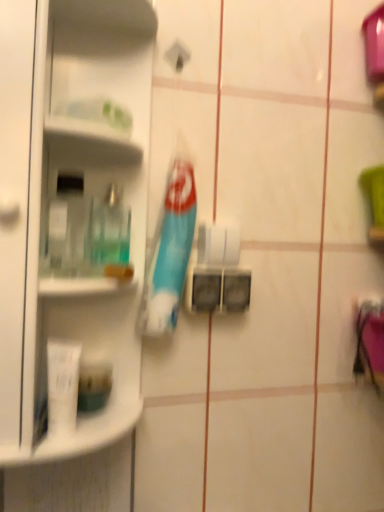
Describe the element at coordinates (109, 229) in the screenshot. I see `translucent plastic mouthwash at left` at that location.

What do you see at coordinates (62, 384) in the screenshot? This screenshot has width=384, height=512. I see `white matte tube at lower left, the second toiletry in the back-to-front sequence` at bounding box center [62, 384].

Describe the element at coordinates (68, 228) in the screenshot. The image size is (384, 512). I see `clear plastic bottle at left` at that location.

Locate an element on the screen. The width and height of the screenshot is (384, 512). matte green container at lower left, the second toiletry in the front-to-back sequence is located at coordinates (94, 386).

Find the location of `white glossy shelf at upper left`. white glossy shelf at upper left is located at coordinates (81, 218).

I want to click on white matte toilet paper at center, so click(218, 244).

Can you confirm if translucent plastic mouthwash at left is positioned to the left of clear plastic bottle at left?

Incorrect, translucent plastic mouthwash at left is not on the left side of clear plastic bottle at left.

Image resolution: width=384 pixels, height=512 pixels. I want to click on cleaning product above the translucent plastic mouthwash at left (from the image's perspective), so click(68, 228).

From the image's perspective, is translucent plastic mouthwash at left above or below clear plastic bottle at left?

Based on their image positions, translucent plastic mouthwash at left is located beneath clear plastic bottle at left.

Is translucent plastic mouthwash at left surrounding clear plastic bottle at left?

That's incorrect, clear plastic bottle at left is not inside translucent plastic mouthwash at left.

From a real-world perspective, does matte green container at lower left, the second toiletry in the front-to-back sequence, stand above white matte toilet paper at center?

No, from a real-world perspective, matte green container at lower left, the second toiletry in the front-to-back sequence, is not over white matte toilet paper at center

Is matte green container at lower left, the second toiletry in the front-to-back sequence, with white matte toilet paper at center?

They are not placed beside each other.

Considering the positions of objects matte green container at lower left, the second toiletry in the front-to-back sequence, and white matte toilet paper at center in the image provided, who is more to the left, matte green container at lower left, the second toiletry in the front-to-back sequence, or white matte toilet paper at center?

matte green container at lower left, the second toiletry in the front-to-back sequence.

Considering the relative sizes of matte green container at lower left, the second toiletry in the front-to-back sequence, and white matte toilet paper at center in the image provided, is matte green container at lower left, the second toiletry in the front-to-back sequence, taller than white matte toilet paper at center?

Incorrect, the height of matte green container at lower left, the second toiletry in the front-to-back sequence, is not larger of that of white matte toilet paper at center.

Which object is further away from the camera, translucent plastic mouthwash at left or white matte toilet paper at center?

white matte toilet paper at center is further from the camera.

From the image's perspective, which one is positioned higher, translucent plastic mouthwash at left or white matte toilet paper at center?

From the image's view, translucent plastic mouthwash at left is above.

Is translucent plastic mouthwash at left shorter than white matte toilet paper at center?

No, translucent plastic mouthwash at left is not shorter than white matte toilet paper at center.

Considering the positions of objects white matte toilet paper at center and matte green container at lower left, the second toiletry in the front-to-back sequence, in the image provided, who is more to the right, white matte toilet paper at center or matte green container at lower left, the second toiletry in the front-to-back sequence,?

Positioned to the right is white matte toilet paper at center.

Which of these two, white matte toilet paper at center or matte green container at lower left, the second toiletry in the front-to-back sequence, is smaller?

white matte toilet paper at center is smaller.

Does white matte toilet paper at center have a greater width compared to matte green container at lower left, which is the 1th toiletry from back to front?

In fact, white matte toilet paper at center might be narrower than matte green container at lower left, which is the 1th toiletry from back to front.

Consider the image. Can you tell me how much white matte toilet paper at center and matte green container at lower left, the second toiletry in the front-to-back sequence, differ in facing direction?

0.884 degrees.

From a real-world perspective, is matte green container at lower left, which is the 1th toiletry from back to front, on white glossy shelf at upper left?

No, from a real-world perspective, matte green container at lower left, which is the 1th toiletry from back to front, is not above white glossy shelf at upper left.

Does matte green container at lower left, the second toiletry in the front-to-back sequence, turn towards white glossy shelf at upper left?

Yes.

Based on the photo, is matte green container at lower left, the second toiletry in the front-to-back sequence, outside of white glossy shelf at upper left?

No, matte green container at lower left, the second toiletry in the front-to-back sequence, is inside or overlapping with white glossy shelf at upper left.

Is white matte toilet paper at center further to camera compared to clear plastic bottle at left?

Yes, it is behind clear plastic bottle at left.

Is white matte toilet paper at center not close to clear plastic bottle at left?

They are positioned close to each other.

Does point (205, 257) appear closer or farther from the camera than point (52, 206)?

Point (205, 257) is farther from the camera than point (52, 206).

Would you say white matte toilet paper at center is to the left or to the right of blue plastic toothbrush at center in the picture?

white matte toilet paper at center is positioned on blue plastic toothbrush at center's right side.

Is the position of white matte toilet paper at center more distant than that of blue plastic toothbrush at center?

Yes, white matte toilet paper at center is behind blue plastic toothbrush at center.

Considering the positions of points (206, 244) and (182, 159), is point (206, 244) farther from camera compared to point (182, 159)?

Yes, it is behind point (182, 159).

This screenshot has height=512, width=384. Find the location of `mouthwash below the clear plastic bottle at left (from the image's perspective)`. mouthwash below the clear plastic bottle at left (from the image's perspective) is located at coordinates (109, 229).

This screenshot has height=512, width=384. What are the coordinates of `toilet paper located on the right of matte green container at lower left, which is the 1th toiletry from back to front` in the screenshot? It's located at (218, 244).

Estimate the real-world distances between objects in this image. Which object is closer to clear plastic bottle at left, white matte toilet paper at center or blue plastic toothbrush at center?

Based on the image, blue plastic toothbrush at center appears to be nearer to clear plastic bottle at left.

Estimate the real-world distances between objects in this image. Which object is closer to white glossy shelf at upper left, white matte toilet paper at center or white matte tube at lower left, the second toiletry in the back-to-front sequence?

white matte tube at lower left, the second toiletry in the back-to-front sequence, is closer to white glossy shelf at upper left.

From the image, which object appears to be farther from clear plastic bottle at left, translucent plastic mouthwash at left or white glossy shelf at upper left?

white glossy shelf at upper left.

Which object lies further to the anchor point translucent plastic mouthwash at left, white glossy shelf at upper left or matte green container at lower left, the second toiletry in the front-to-back sequence?

matte green container at lower left, the second toiletry in the front-to-back sequence, is positioned further to the anchor translucent plastic mouthwash at left.

From the image, which object appears to be farther from clear plastic bottle at left, white glossy shelf at upper left or white matte toilet paper at center?

white matte toilet paper at center is positioned further to the anchor clear plastic bottle at left.

Which object lies nearer to the anchor point blue plastic toothbrush at center, clear plastic bottle at left or translucent plastic mouthwash at left?

translucent plastic mouthwash at left is closer to blue plastic toothbrush at center.

From the image, which object appears to be farther from matte green container at lower left, the second toiletry in the front-to-back sequence, white matte toilet paper at center or white matte tube at lower left, acting as the first toiletry starting from the front?

Based on the image, white matte toilet paper at center appears to be further to matte green container at lower left, the second toiletry in the front-to-back sequence.

Based on their spatial positions, is white matte tube at lower left, acting as the first toiletry starting from the front, or matte green container at lower left, the second toiletry in the front-to-back sequence, further from white matte toilet paper at center?

Among the two, white matte tube at lower left, acting as the first toiletry starting from the front, is located further to white matte toilet paper at center.

Where is `shelf between clear plastic bottle at left and white matte toilet paper at center from left to right`? The width and height of the screenshot is (384, 512). shelf between clear plastic bottle at left and white matte toilet paper at center from left to right is located at coordinates (81, 218).

Identify the location of toothbrush between white glossy shelf at upper left and matte green container at lower left, the second toiletry in the front-to-back sequence, in the up-down direction. (170, 252).

This screenshot has width=384, height=512. Identify the location of toilet paper between translucent plastic mouthwash at left and white matte tube at lower left, acting as the first toiletry starting from the front, vertically. (218, 244).

At what (x,y) coordinates should I click in order to perform the action: click on toothbrush between white glossy shelf at upper left and white matte tube at lower left, acting as the first toiletry starting from the front, from top to bottom. Please return your answer as a coordinate pair (x, y). The image size is (384, 512). Looking at the image, I should click on (170, 252).